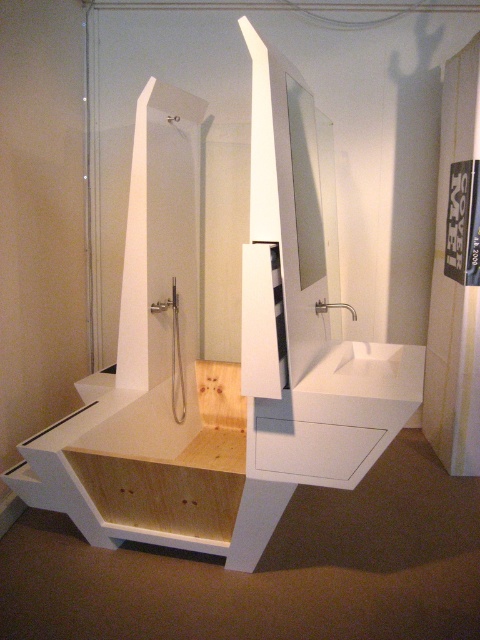
You are a bathroom designer planning to install a new decorative shelf between the white matte sink at center and the clear glass mirror at center. The shelf requires a minimum of 24 inches of space between the two fixtures to be securely mounted. Based on the current setup, will the shelf fit?

The white matte sink at center and clear glass mirror at center are 23.81 inches apart from each other, which is less than the required 24 inches. Therefore, the shelf will not fit securely between them.

You are a home decorator planning to install a new light fixture in the bathroom. The light needs to be placed above the white matte sink at center but must not interfere with the clear glass mirror at center. Based on the scene description, is this possible?

The white matte sink at center is positioned under the clear glass mirror at center, so placing the light fixture above the sink would mean it is also below the mirror. This placement would not interfere with the mirror as the mirror is above the sink.